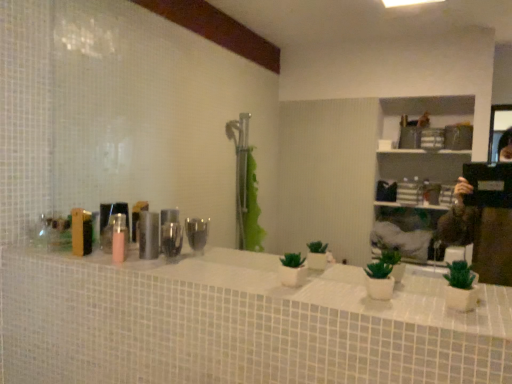
Question: Is wooden box at left, arranged as the second toiletry when viewed from the right, inside the boundaries of white glossy counter top at center, or outside?

Choices:
 (A) inside
 (B) outside

Answer: (B)

Question: Is wooden box at left, arranged as the second toiletry when viewed from the right, to the left or to the right of white glossy counter top at center in the image?

Choices:
 (A) right
 (B) left

Answer: (B)

Question: Which object is the farthest from the wooden box at left, arranged as the second toiletry when viewed from the right?

Choices:
 (A) white glossy counter top at center
 (B) metallic cylindrical container at center, the 2th toiletry positioned from the left

Answer: (A)

Question: Which of these objects is positioned closest to the wooden box at left, the first toiletry when ordered from left to right?

Choices:
 (A) metallic cylindrical container at center, which is the first toiletry in right-to-left order
 (B) white glossy counter top at center

Answer: (A)